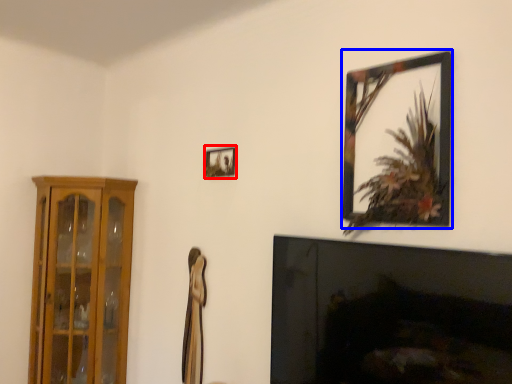
Question: Which object is further to the camera taking this photo, picture frame (highlighted by a red box) or picture frame (highlighted by a blue box)?

Choices:
 (A) picture frame
 (B) picture frame

Answer: (A)